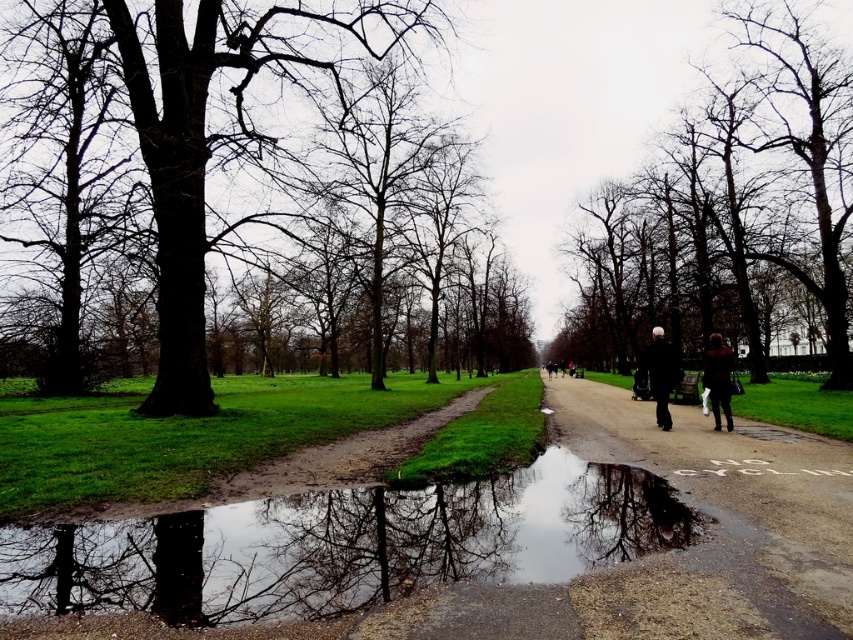
Question: Which point is farther from the camera taking this photo?

Choices:
 (A) (331, 349)
 (B) (791, 452)
 (C) (782, 145)
 (D) (283, 596)

Answer: (A)

Question: Among these objects, which one is nearest to the camera?

Choices:
 (A) dark brown leather jacket at center-right
 (B) dark brown bark tree at left
 (C) transparent water at lower center

Answer: (C)

Question: Can you confirm if transparent water at lower center is positioned above dark gray fabric jacket at right?

Choices:
 (A) yes
 (B) no

Answer: (B)

Question: Can you confirm if transparent water at lower center is wider than dark brown bark tree at center?

Choices:
 (A) no
 (B) yes

Answer: (A)

Question: Does damp concrete path at center have a greater width compared to dark brown leather jacket at center-right?

Choices:
 (A) yes
 (B) no

Answer: (A)

Question: Which is farther from the dark brown bark tree at left?

Choices:
 (A) transparent water at lower center
 (B) damp concrete path at center

Answer: (A)